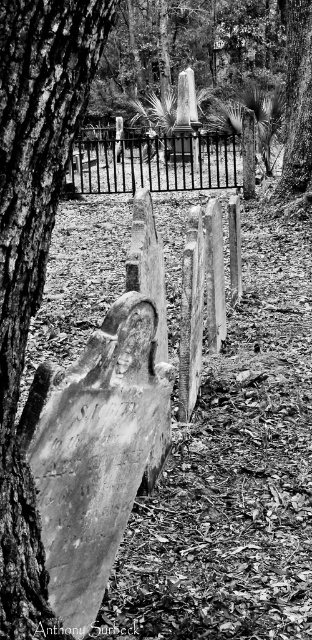
Who is shorter, smooth bark tree trunk at left or black wrought iron fence at center?

Standing shorter between the two is smooth bark tree trunk at left.

Looking at this image, does smooth bark tree trunk at left have a lesser height compared to black wrought iron fence at center?

Indeed, smooth bark tree trunk at left has a lesser height compared to black wrought iron fence at center.

Locate an element on the screen. smooth bark tree trunk at left is located at coordinates (33, 250).

Image resolution: width=312 pixels, height=640 pixels. In order to click on smooth bark tree trunk at left in this screenshot , I will do `click(33, 250)`.